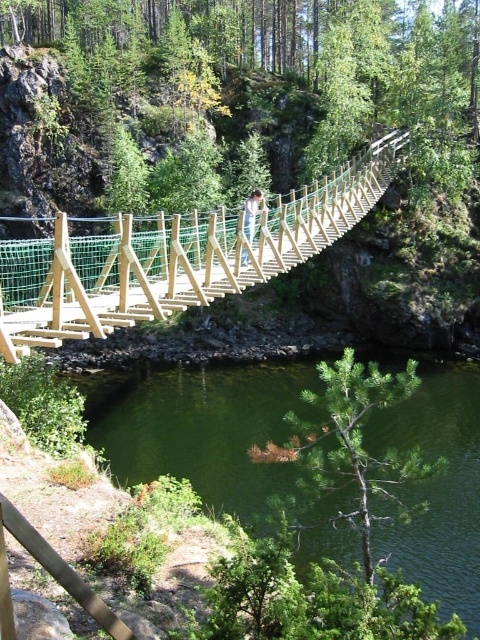
Can you confirm if wooden suspension bridge at center is smaller than wooden post at center?

No.

Between wooden suspension bridge at center and wooden post at center, which one has more height?

wooden suspension bridge at center is taller.

Is point (51, 273) less distant than point (253, 204)?

Yes.

This screenshot has width=480, height=640. Identify the location of wooden suspension bridge at center. coord(173,257).

Does point (370, 198) come closer to viewer compared to point (450, 451)?

No, (370, 198) is behind (450, 451).

Is point (213, 296) closer to camera compared to point (212, 470)?

Yes.

Find the location of a particular element. This screenshot has height=640, width=480. wooden suspension bridge at center is located at coordinates (x=173, y=257).

Between green water at lower center and wooden post at center, which one has less height?

With less height is green water at lower center.

Can you confirm if green water at lower center is wider than wooden post at center?

Indeed, green water at lower center has a greater width compared to wooden post at center.

Locate an element on the screen. The width and height of the screenshot is (480, 640). green water at lower center is located at coordinates (204, 432).